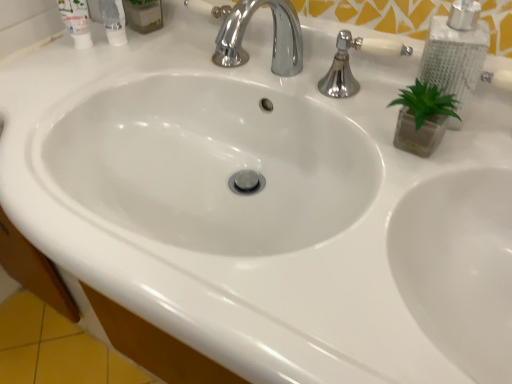
Identify the location of vacant area that lies between polished chrome faucet at upper center and chrome metallic faucet at upper center. (327, 99).